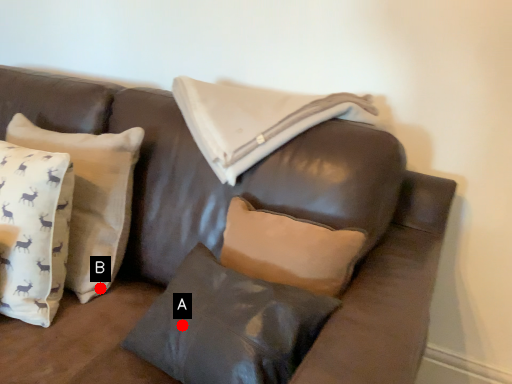
Question: Two points are circled on the image, labeled by A and B beside each circle. Which of the following is the farthest from the observer?

Choices:
 (A) A is further
 (B) B is further

Answer: (B)